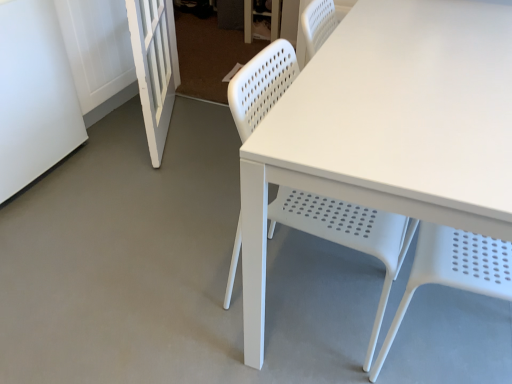
Question: Is white plastic chair at center at the left side of white matte screen door at left, positioned as the second screen door in left-to-right order?

Choices:
 (A) no
 (B) yes

Answer: (A)

Question: From the image's perspective, is white plastic chair at center under white matte screen door at left, positioned as the second screen door in left-to-right order?

Choices:
 (A) no
 (B) yes

Answer: (B)

Question: Is white plastic chair at center not inside white matte screen door at left, the 1th screen door viewed from the right?

Choices:
 (A) no
 (B) yes

Answer: (B)

Question: Can white matte screen door at left, the 1th screen door viewed from the right, be found inside white plastic chair at center?

Choices:
 (A) no
 (B) yes

Answer: (A)

Question: Would you consider white plastic chair at center to be distant from white matte screen door at left, positioned as the second screen door in left-to-right order?

Choices:
 (A) yes
 (B) no

Answer: (B)

Question: From a real-world perspective, is white plastic chair at center under white matte screen door at left, positioned as the second screen door in left-to-right order?

Choices:
 (A) yes
 (B) no

Answer: (B)

Question: From a real-world perspective, is white matte screen door at left, which appears as the 2th screen door when viewed from the right, below white plastic chair at center?

Choices:
 (A) yes
 (B) no

Answer: (A)

Question: From the image's perspective, is white matte screen door at left, which appears as the 2th screen door when viewed from the right, beneath white plastic chair at center?

Choices:
 (A) no
 (B) yes

Answer: (A)

Question: Is white matte screen door at left, the first screen door positioned from the left, to the left of white plastic chair at center from the viewer's perspective?

Choices:
 (A) yes
 (B) no

Answer: (A)

Question: Considering the relative sizes of white matte screen door at left, the first screen door positioned from the left, and white plastic chair at center in the image provided, is white matte screen door at left, the first screen door positioned from the left, thinner than white plastic chair at center?

Choices:
 (A) no
 (B) yes

Answer: (A)

Question: Is white matte screen door at left, the first screen door positioned from the left, oriented towards white plastic chair at center?

Choices:
 (A) no
 (B) yes

Answer: (B)

Question: Is white matte screen door at left, the first screen door positioned from the left, positioned with its back to white plastic chair at center?

Choices:
 (A) yes
 (B) no

Answer: (B)

Question: Considering the relative sizes of white matte screen door at left, positioned as the second screen door in left-to-right order, and white matte screen door at left, which appears as the 2th screen door when viewed from the right, in the image provided, is white matte screen door at left, positioned as the second screen door in left-to-right order, thinner than white matte screen door at left, which appears as the 2th screen door when viewed from the right,?

Choices:
 (A) no
 (B) yes

Answer: (B)